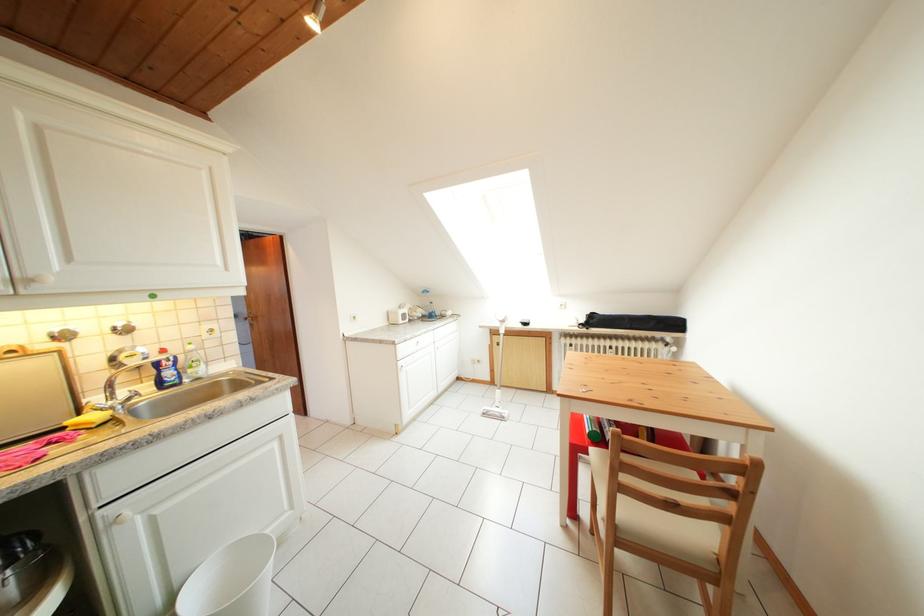
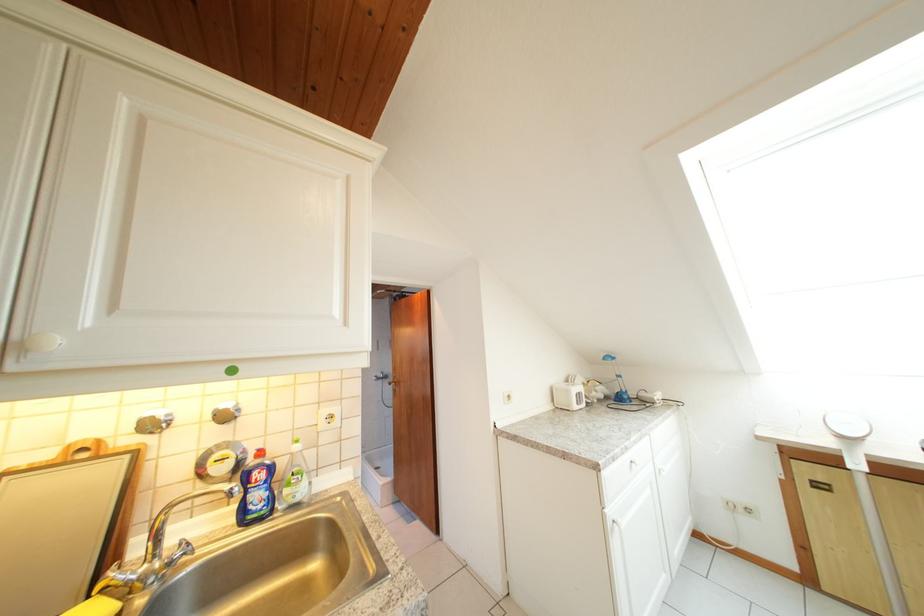
Locate, in the second image, the point that corresponds to (x=73, y=342) in the first image.

(162, 431)